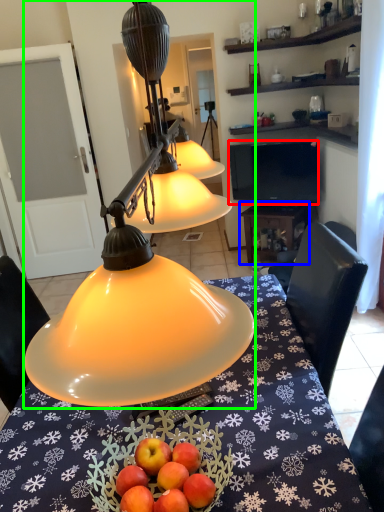
Question: Which object is the farthest from television (highlighted by a red box)? Choose among these: table (highlighted by a blue box) or lamp (highlighted by a green box).

Choices:
 (A) table
 (B) lamp

Answer: (B)